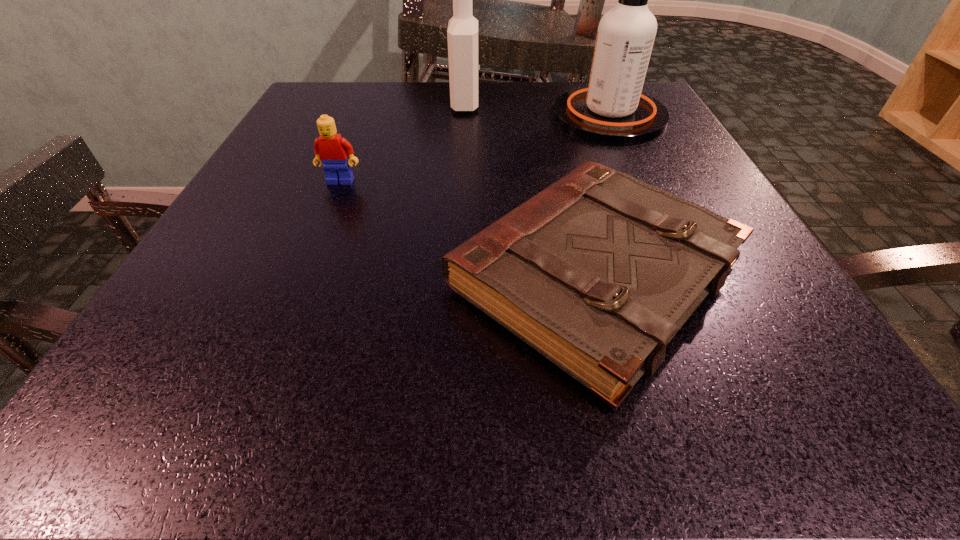
This screenshot has height=540, width=960. Identify the location of free location at the near left corner. (218, 418).

Identify the location of vacant space that is in between the left cleansing agent and the leftmost object. (403, 143).

Locate an element on the screen. The image size is (960, 540). vacant area that lies between the nearest object and the left cleansing agent is located at coordinates (530, 190).

Find the location of a particular element. This screenshot has height=540, width=960. unoccupied area between the left cleansing agent and the third tallest object is located at coordinates (403, 143).

Where is `vacant region between the right cleansing agent and the left cleansing agent`? vacant region between the right cleansing agent and the left cleansing agent is located at coordinates (538, 110).

The height and width of the screenshot is (540, 960). Find the location of `free space between the nearest object and the second nearest object`. free space between the nearest object and the second nearest object is located at coordinates (467, 229).

Where is `vacant space that's between the second shortest object and the hardback book`? The height and width of the screenshot is (540, 960). vacant space that's between the second shortest object and the hardback book is located at coordinates (467, 229).

Locate an element on the screen. Image resolution: width=960 pixels, height=540 pixels. vacant point located between the leftmost object and the nearest object is located at coordinates (467, 229).

This screenshot has height=540, width=960. What are the coordinates of `free space that is in between the right cleansing agent and the left cleansing agent` in the screenshot? It's located at (538, 110).

Locate an element on the screen. vacant space that is in between the right cleansing agent and the third farthest object is located at coordinates (475, 148).